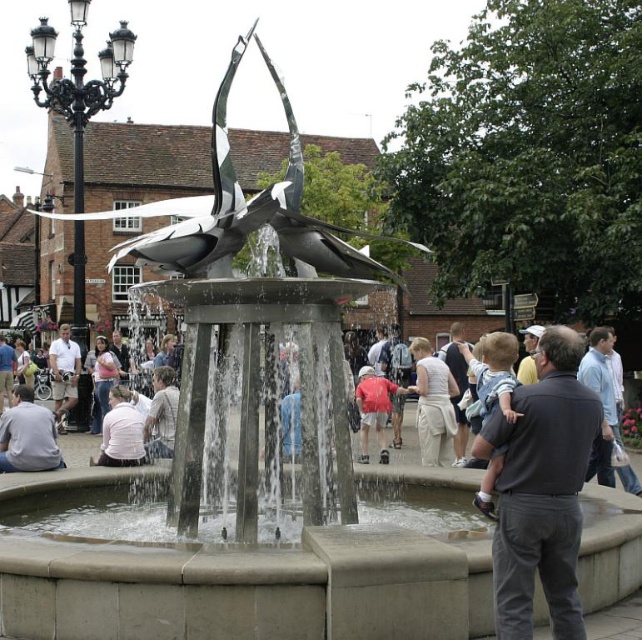
Who is taller, gray fabric shirt at lower left or light pink shirt at center?

light pink shirt at center

In the scene shown: Does gray fabric shirt at lower left appear under light pink shirt at center?

Incorrect, gray fabric shirt at lower left is not positioned below light pink shirt at center.

Is point (55, 465) more distant than point (125, 445)?

No.

Locate an element on the screen. The image size is (642, 640). gray fabric shirt at lower left is located at coordinates (28, 435).

The image size is (642, 640). What do you see at coordinates (28, 435) in the screenshot?
I see `gray fabric shirt at lower left` at bounding box center [28, 435].

Does gray fabric shirt at lower left have a lesser height compared to matte red shirt at center?

Yes.

Locate an element on the screen. The width and height of the screenshot is (642, 640). gray fabric shirt at lower left is located at coordinates (28, 435).

Is dark gray suit at center in front of light pink shirt at center?

Yes, dark gray suit at center is closer to the viewer.

Is point (521, 476) positioned after point (108, 406)?

No, (521, 476) is closer to viewer.

Is point (562, 432) positioned in front of point (114, 397)?

Yes, it is in front of point (114, 397).

At what (x,y) coordinates should I click in order to perform the action: click on dark gray suit at center. Please return your answer as a coordinate pair (x, y). The height and width of the screenshot is (640, 642). Looking at the image, I should click on (541, 490).